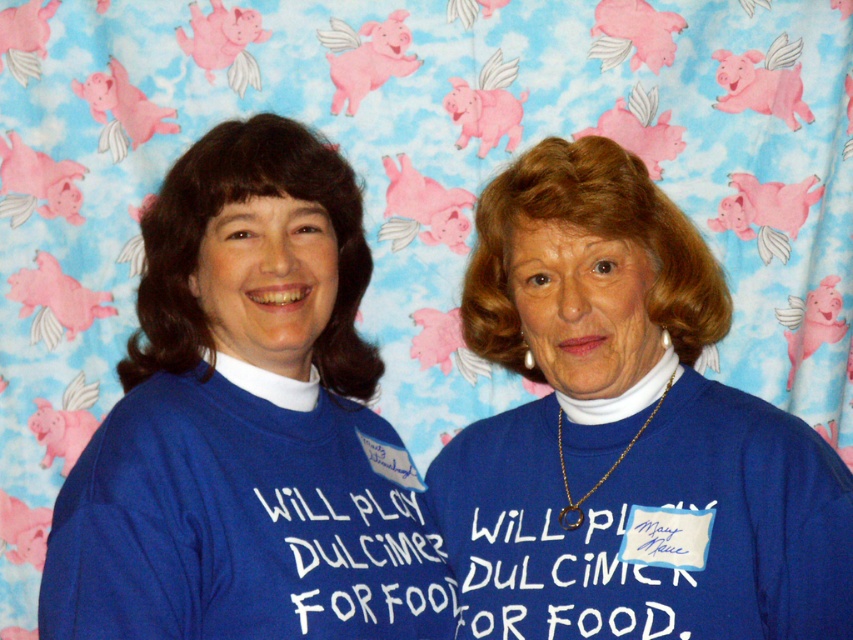
Is blue cotton shirt at center shorter than blue matte shirt at center?

Yes.

This screenshot has width=853, height=640. In order to click on blue cotton shirt at center in this screenshot , I will do `click(625, 432)`.